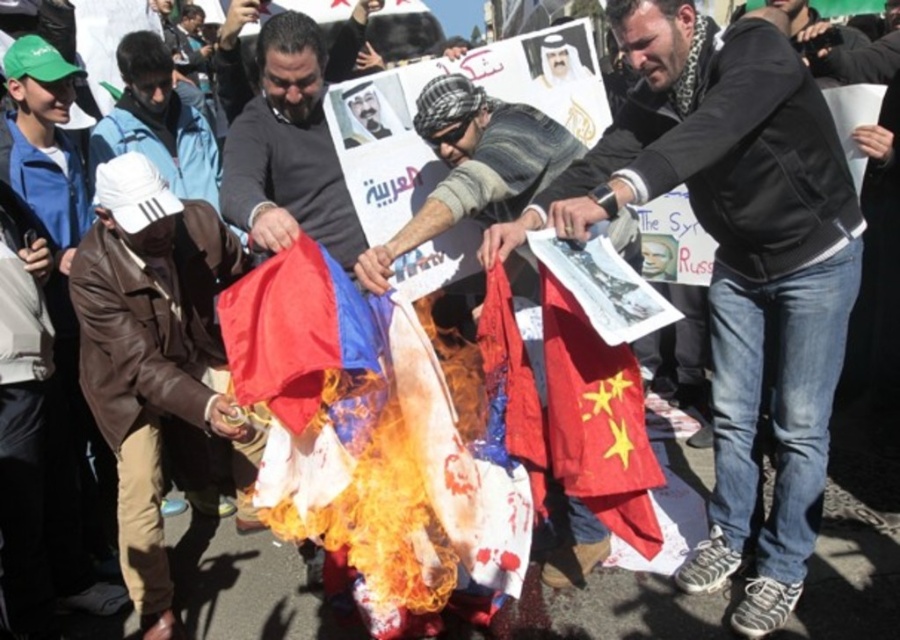
Does brown leather jacket at left appear over smooth beige face at center?

No, brown leather jacket at left is not above smooth beige face at center.

From the picture: Is brown leather jacket at left to the right of smooth beige face at center from the viewer's perspective?

In fact, brown leather jacket at left is to the left of smooth beige face at center.

This screenshot has width=900, height=640. Describe the element at coordinates (158, 365) in the screenshot. I see `brown leather jacket at left` at that location.

Identify the location of brown leather jacket at left. (158, 365).

Between point (588, 349) and point (274, 282), which one is positioned in front?

Positioned in front is point (274, 282).

In the scene shown: Who is more distant from viewer, (x=549, y=422) or (x=308, y=396)?

The point (x=549, y=422) is behind.

This screenshot has height=640, width=900. Identify the location of red fabric flag at center. (597, 420).

Does white fabric cap at upper left have a smaller size compared to smooth beige face at center?

No, white fabric cap at upper left is not smaller than smooth beige face at center.

Does point (173, 168) come behind point (572, 67)?

Yes, it is.

Where is `white fabric cap at upper left`? white fabric cap at upper left is located at coordinates (158, 122).